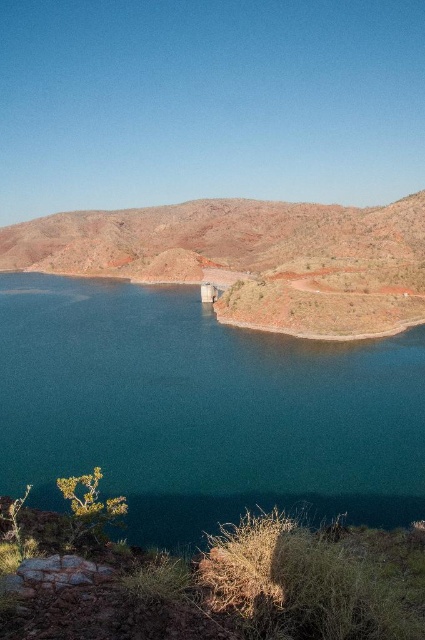
Can you confirm if teal glossy water at center is smaller than rustic brown hillside at center?

Correct, teal glossy water at center occupies less space than rustic brown hillside at center.

Does teal glossy water at center have a lesser height compared to rustic brown hillside at center?

Yes.

Describe the element at coordinates (201, 410) in the screenshot. I see `teal glossy water at center` at that location.

The height and width of the screenshot is (640, 425). Find the location of `teal glossy water at center`. teal glossy water at center is located at coordinates (201, 410).